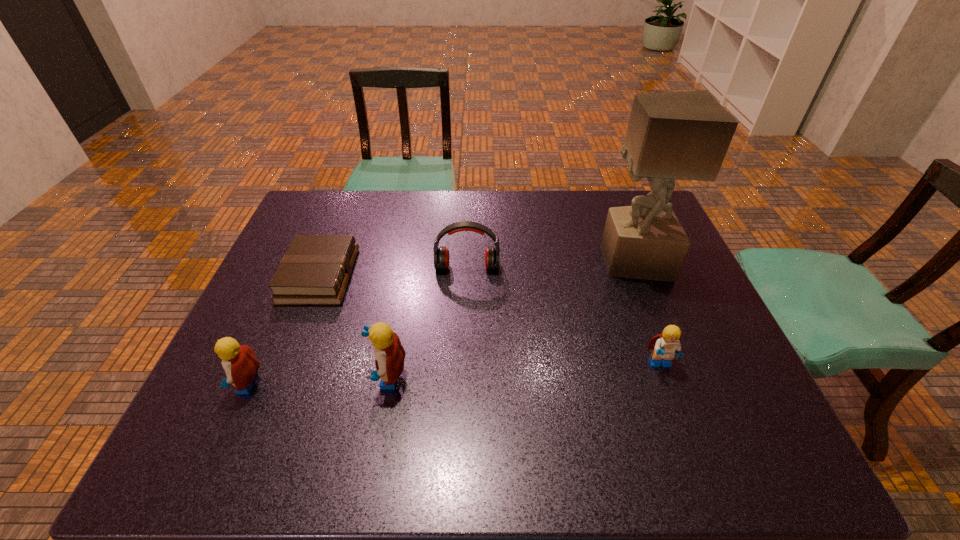
Image resolution: width=960 pixels, height=540 pixels. Find the location of `free space that satisfies the following two spatial constraints: 1. on the ear cups of the earphone; 2. on the front-facing side of the second Lego from right to left`. free space that satisfies the following two spatial constraints: 1. on the ear cups of the earphone; 2. on the front-facing side of the second Lego from right to left is located at coordinates (464, 377).

The image size is (960, 540). What are the coordinates of `vacant area that satisfies the following two spatial constraints: 1. on the front-facing side of the sculpture; 2. on the ear cups of the fourth object from left to right` in the screenshot? It's located at (636, 267).

Locate an element on the screen. This screenshot has height=540, width=960. vacant region that satisfies the following two spatial constraints: 1. on the front-facing side of the tallest object; 2. on the ear cups of the earphone is located at coordinates (636, 267).

Where is `free location that satisfies the following two spatial constraints: 1. on the ear cups of the earphone; 2. on the front-facing side of the second Lego from left to right`? The width and height of the screenshot is (960, 540). free location that satisfies the following two spatial constraints: 1. on the ear cups of the earphone; 2. on the front-facing side of the second Lego from left to right is located at coordinates (464, 377).

Where is `free space that satisfies the following two spatial constraints: 1. on the ear cups of the fourth object from left to right; 2. on the spine side of the Bible`? free space that satisfies the following two spatial constraints: 1. on the ear cups of the fourth object from left to right; 2. on the spine side of the Bible is located at coordinates (467, 276).

The width and height of the screenshot is (960, 540). I want to click on vacant space that satisfies the following two spatial constraints: 1. on the front-facing side of the second shortest object; 2. on the front-facing side of the leftmost Lego, so click(667, 384).